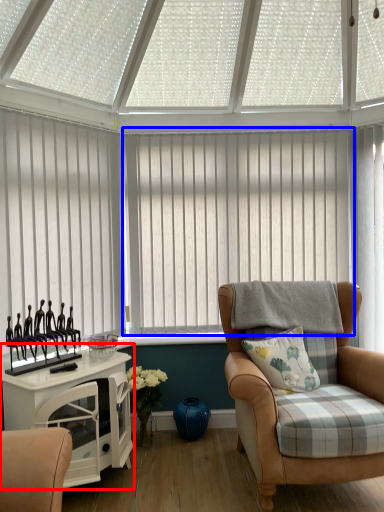
Question: Which object appears farthest to the camera in this image, table (highlighted by a red box) or window blind (highlighted by a blue box)?

Choices:
 (A) table
 (B) window blind

Answer: (B)